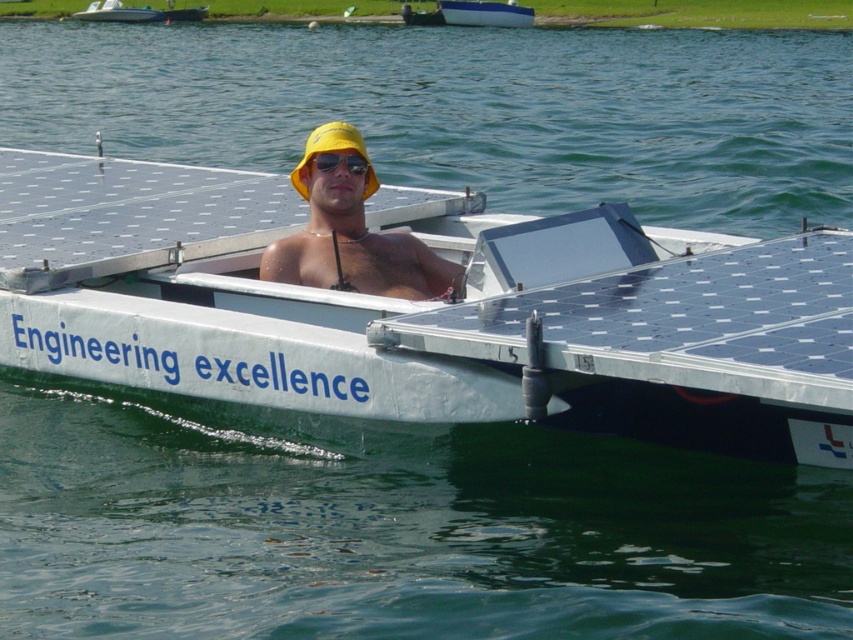
You are a photographer trying to capture the white metallic boat at center and the yellow matte hat at center in the same frame. Based on their sizes, which object should you focus on first to ensure both fit in the photo?

The white metallic boat at center is shorter than the yellow matte hat at center, so you should focus on the yellow matte hat at center first to ensure both fit in the photo.

You are a photographer trying to capture the blue glossy boat at upper center and the black reflective sunglasses at center in a single shot. Which object will appear larger in the photo?

The blue glossy boat at upper center will appear larger in the photo because it is much taller than the black reflective sunglasses at center.